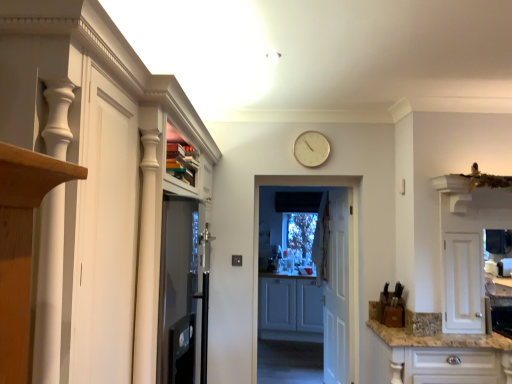
Question: Is white wooden door at center, which is counted as the 2th door, starting from the back, located outside white wooden door at center, which is counted as the second door, starting from the front?

Choices:
 (A) yes
 (B) no

Answer: (A)

Question: Considering the relative sizes of white wooden door at center, which ranks as the second door in right-to-left order, and white wooden door at center, the 1th door when ordered from back to front, in the image provided, is white wooden door at center, which ranks as the second door in right-to-left order, smaller than white wooden door at center, the 1th door when ordered from back to front,?

Choices:
 (A) yes
 (B) no

Answer: (A)

Question: Can you confirm if white wooden door at center, which is the first door from front to back, is positioned to the left of white wooden door at center, which appears as the first door when viewed from the right?

Choices:
 (A) yes
 (B) no

Answer: (A)

Question: Is the depth of white wooden door at center, which ranks as the second door in right-to-left order, greater than that of white wooden door at center, the 1th door when ordered from back to front?

Choices:
 (A) no
 (B) yes

Answer: (A)

Question: Does white wooden door at center, which appears as the 1th door when viewed from the left, have a greater height compared to white wooden door at center, which is counted as the second door, starting from the front?

Choices:
 (A) no
 (B) yes

Answer: (A)

Question: From a real-world perspective, is white wooden door at center, which appears as the 1th door when viewed from the left, on top of white wooden door at center, which is the second door from left to right?

Choices:
 (A) no
 (B) yes

Answer: (B)

Question: Is white wooden door at center, which is the second door from left to right, positioned behind white glossy cabinet at lower right, which is the 1th cabinetry from right to left?

Choices:
 (A) yes
 (B) no

Answer: (A)

Question: Is there a large distance between white wooden door at center, the 1th door when ordered from back to front, and white glossy cabinet at lower right, acting as the second cabinetry starting from the back?

Choices:
 (A) yes
 (B) no

Answer: (A)

Question: Can you confirm if white wooden door at center, which is the second door from left to right, is bigger than white glossy cabinet at lower right, the third cabinetry positioned from the left?

Choices:
 (A) yes
 (B) no

Answer: (B)

Question: Can you confirm if white wooden door at center, the 1th door when ordered from back to front, is positioned to the right of white glossy cabinet at lower right, positioned as the second cabinetry in front-to-back order?

Choices:
 (A) yes
 (B) no

Answer: (B)

Question: From the image's perspective, is white wooden door at center, which is the second door from left to right, under white glossy cabinet at lower right, acting as the second cabinetry starting from the back?

Choices:
 (A) no
 (B) yes

Answer: (A)

Question: Can we say white wooden door at center, which appears as the first door when viewed from the right, lies outside white glossy cabinet at lower right, the third cabinetry positioned from the left?

Choices:
 (A) yes
 (B) no

Answer: (A)

Question: Is white wooden door at center, which appears as the first door when viewed from the right, a part of white glossy cabinet at left, which is the 3th cabinetry in back-to-front order?

Choices:
 (A) yes
 (B) no

Answer: (B)